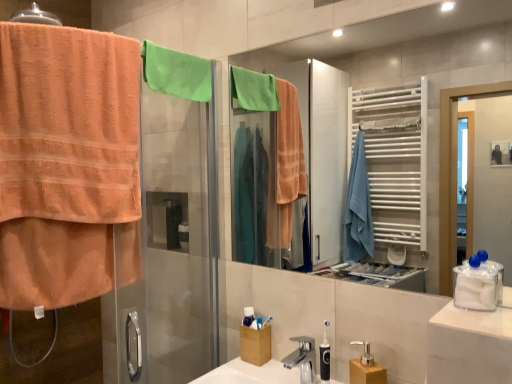
Question: Would you say orange terry cloth towel at left is part of matte glass mirror at center's contents?

Choices:
 (A) no
 (B) yes

Answer: (A)

Question: Is matte glass mirror at center closer to camera compared to orange terry cloth towel at left?

Choices:
 (A) yes
 (B) no

Answer: (A)

Question: Is matte glass mirror at center bigger than orange terry cloth towel at left?

Choices:
 (A) no
 (B) yes

Answer: (A)

Question: Does matte glass mirror at center have a greater width compared to orange terry cloth towel at left?

Choices:
 (A) no
 (B) yes

Answer: (A)

Question: Is matte glass mirror at center completely or partially outside of orange terry cloth towel at left?

Choices:
 (A) no
 (B) yes

Answer: (B)

Question: Considering the positions of orange terry cloth towel at left and black plastic toothbrush at center, marked as the 2th toiletry in a left-to-right arrangement, in the image, is orange terry cloth towel at left bigger or smaller than black plastic toothbrush at center, marked as the 2th toiletry in a left-to-right arrangement,?

Choices:
 (A) big
 (B) small

Answer: (A)

Question: In the image, is orange terry cloth towel at left positioned in front of or behind black plastic toothbrush at center, which ranks as the 2th toiletry in back-to-front order?

Choices:
 (A) front
 (B) behind

Answer: (A)

Question: Does point (x=34, y=107) appear closer or farther from the camera than point (x=325, y=380)?

Choices:
 (A) farther
 (B) closer

Answer: (B)

Question: Looking at their shapes, would you say orange terry cloth towel at left is wider or thinner than black plastic toothbrush at center, marked as the 2th toiletry in a left-to-right arrangement?

Choices:
 (A) wide
 (B) thin

Answer: (A)

Question: Based on their positions, is black plastic toothbrush at center, which ranks as the 2th toiletry in back-to-front order, located to the left or right of matte glass mirror at center?

Choices:
 (A) right
 (B) left

Answer: (B)

Question: Is point (326, 364) closer or farther from the camera than point (485, 69)?

Choices:
 (A) closer
 (B) farther

Answer: (A)

Question: Considering their positions, is black plastic toothbrush at center, marked as the 2th toiletry in a left-to-right arrangement, located in front of or behind matte glass mirror at center?

Choices:
 (A) front
 (B) behind

Answer: (B)

Question: From a real-world perspective, is black plastic toothbrush at center, marked as the 2th toiletry in a left-to-right arrangement, positioned above or below matte glass mirror at center?

Choices:
 (A) above
 (B) below

Answer: (B)

Question: From a real-world perspective, is orange terry cloth towel at left above or below white plastic toothbrush at center, arranged as the first toiletry when viewed from the left?

Choices:
 (A) below
 (B) above

Answer: (B)

Question: Is orange terry cloth towel at left to the left or to the right of white plastic toothbrush at center, positioned as the 1th toiletry in back-to-front order, in the image?

Choices:
 (A) left
 (B) right

Answer: (A)